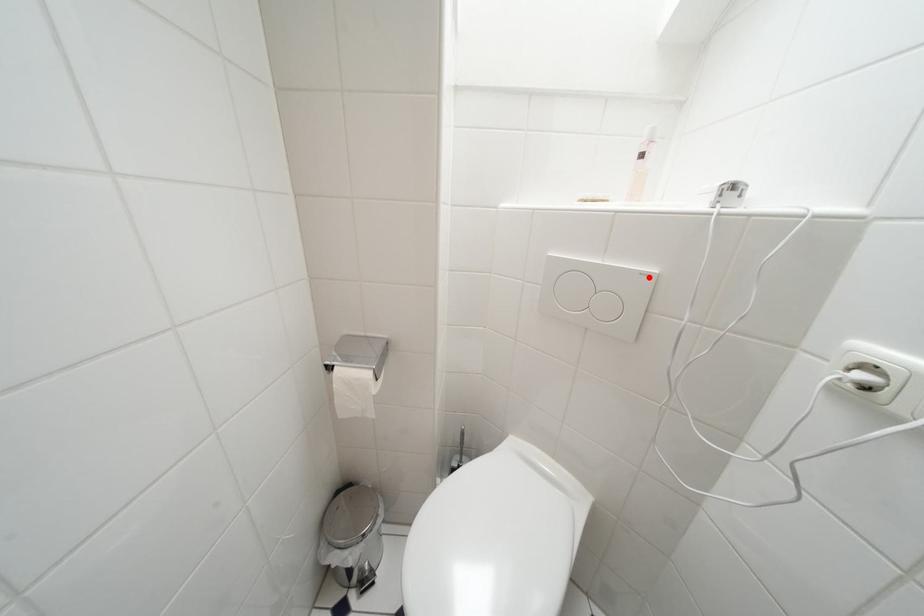
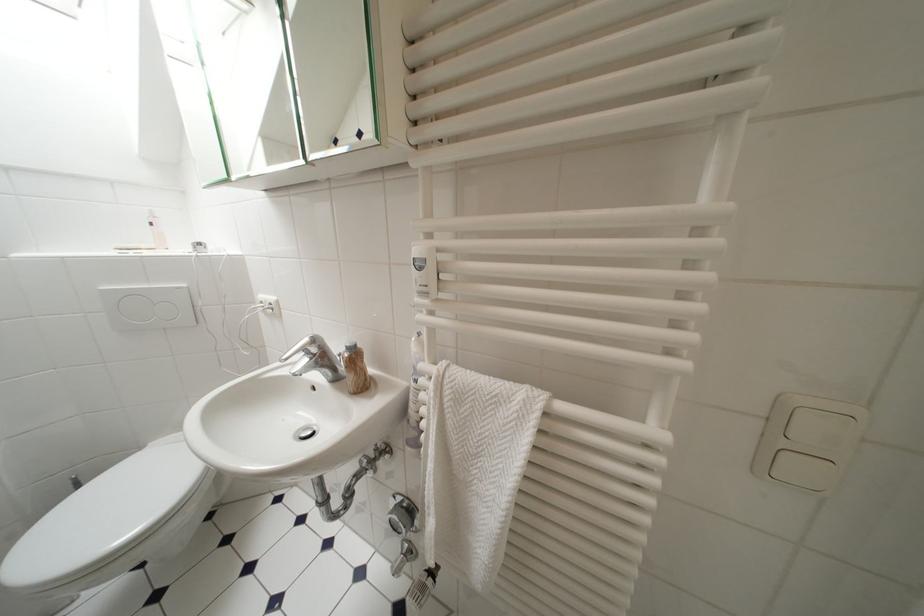
Locate, in the second image, the point that corresponds to the highlighted location in the first image.

(185, 291)